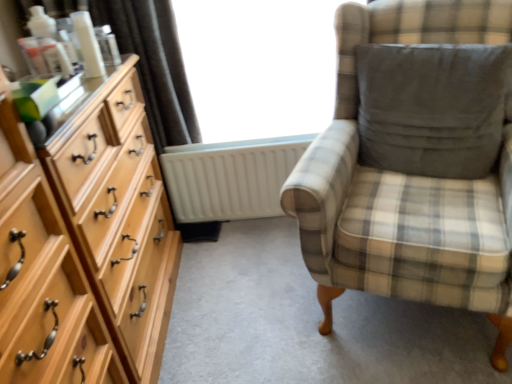
Question: Is white matte radiator at center far away from light wood dresser at left?

Choices:
 (A) yes
 (B) no

Answer: (B)

Question: Is white matte radiator at center thinner than light wood dresser at left?

Choices:
 (A) yes
 (B) no

Answer: (A)

Question: Can you confirm if white matte radiator at center is smaller than light wood dresser at left?

Choices:
 (A) yes
 (B) no

Answer: (A)

Question: From a real-world perspective, is white matte radiator at center physically below light wood dresser at left?

Choices:
 (A) no
 (B) yes

Answer: (B)

Question: Considering the relative sizes of white matte radiator at center and light wood dresser at left in the image provided, is white matte radiator at center taller than light wood dresser at left?

Choices:
 (A) no
 (B) yes

Answer: (A)

Question: Does white matte radiator at center have a lesser height compared to light wood dresser at left?

Choices:
 (A) no
 (B) yes

Answer: (B)

Question: From the image's perspective, does satin dark brown curtain at upper left appear lower than dark gray fabric pillow at right?

Choices:
 (A) no
 (B) yes

Answer: (A)

Question: Is the depth of satin dark brown curtain at upper left greater than that of dark gray fabric pillow at right?

Choices:
 (A) no
 (B) yes

Answer: (B)

Question: Can you confirm if satin dark brown curtain at upper left is bigger than dark gray fabric pillow at right?

Choices:
 (A) yes
 (B) no

Answer: (B)

Question: Could you tell me if satin dark brown curtain at upper left is turned towards dark gray fabric pillow at right?

Choices:
 (A) no
 (B) yes

Answer: (A)

Question: Is satin dark brown curtain at upper left positioned with its back to dark gray fabric pillow at right?

Choices:
 (A) yes
 (B) no

Answer: (B)

Question: Can you confirm if satin dark brown curtain at upper left is taller than dark gray fabric pillow at right?

Choices:
 (A) no
 (B) yes

Answer: (B)

Question: Is plaid fabric chair at right facing away from satin dark brown curtain at upper left?

Choices:
 (A) no
 (B) yes

Answer: (A)